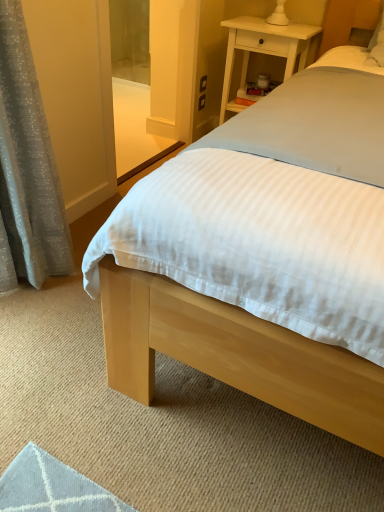
Question: Should I look upward or downward to see light wood bed at center?

Choices:
 (A) down
 (B) up

Answer: (B)

Question: From a real-world perspective, is white wood nightstand at upper right located higher than transparent glass screen door at upper center?

Choices:
 (A) yes
 (B) no

Answer: (B)

Question: Considering the relative sizes of white wood nightstand at upper right and transparent glass screen door at upper center in the image provided, is white wood nightstand at upper right taller than transparent glass screen door at upper center?

Choices:
 (A) yes
 (B) no

Answer: (B)

Question: From a real-world perspective, is white wood nightstand at upper right under transparent glass screen door at upper center?

Choices:
 (A) yes
 (B) no

Answer: (A)

Question: Can you confirm if white wood nightstand at upper right is wider than transparent glass screen door at upper center?

Choices:
 (A) yes
 (B) no

Answer: (A)

Question: Is white wood nightstand at upper right touching transparent glass screen door at upper center?

Choices:
 (A) no
 (B) yes

Answer: (A)

Question: Considering the relative sizes of white wood nightstand at upper right and transparent glass screen door at upper center in the image provided, is white wood nightstand at upper right bigger than transparent glass screen door at upper center?

Choices:
 (A) no
 (B) yes

Answer: (B)

Question: Is gray textured curtain at left to the left of white wood nightstand at upper right from the viewer's perspective?

Choices:
 (A) no
 (B) yes

Answer: (B)

Question: Can we say gray textured curtain at left lies outside white wood nightstand at upper right?

Choices:
 (A) yes
 (B) no

Answer: (A)

Question: Can you confirm if gray textured curtain at left is bigger than white wood nightstand at upper right?

Choices:
 (A) yes
 (B) no

Answer: (A)

Question: Does gray textured curtain at left turn towards white wood nightstand at upper right?

Choices:
 (A) yes
 (B) no

Answer: (B)

Question: Does gray textured curtain at left have a greater width compared to white wood nightstand at upper right?

Choices:
 (A) yes
 (B) no

Answer: (B)

Question: Is gray textured curtain at left to the right of white wood nightstand at upper right from the viewer's perspective?

Choices:
 (A) yes
 (B) no

Answer: (B)

Question: Considering the relative sizes of gray textured curtain at left and light wood bed at center in the image provided, is gray textured curtain at left thinner than light wood bed at center?

Choices:
 (A) yes
 (B) no

Answer: (A)